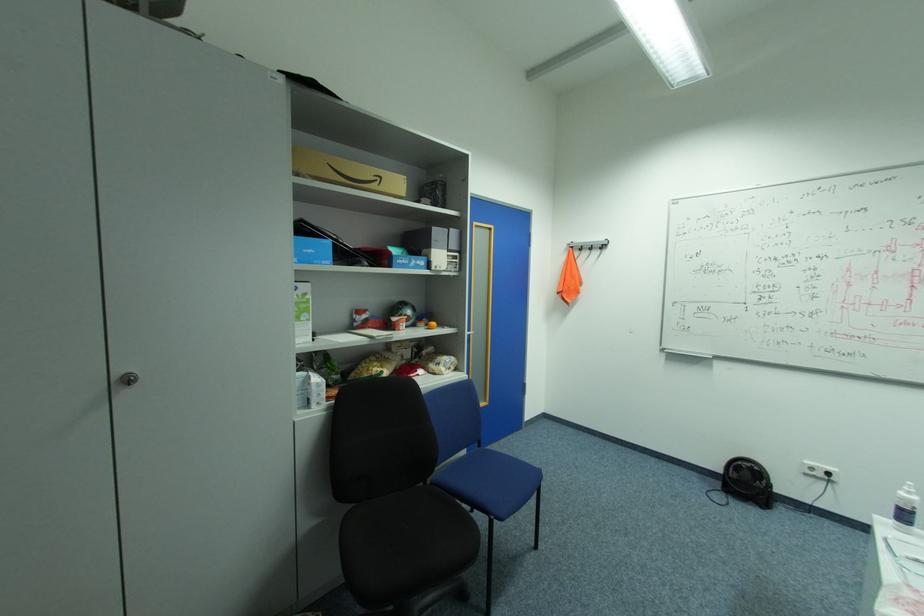
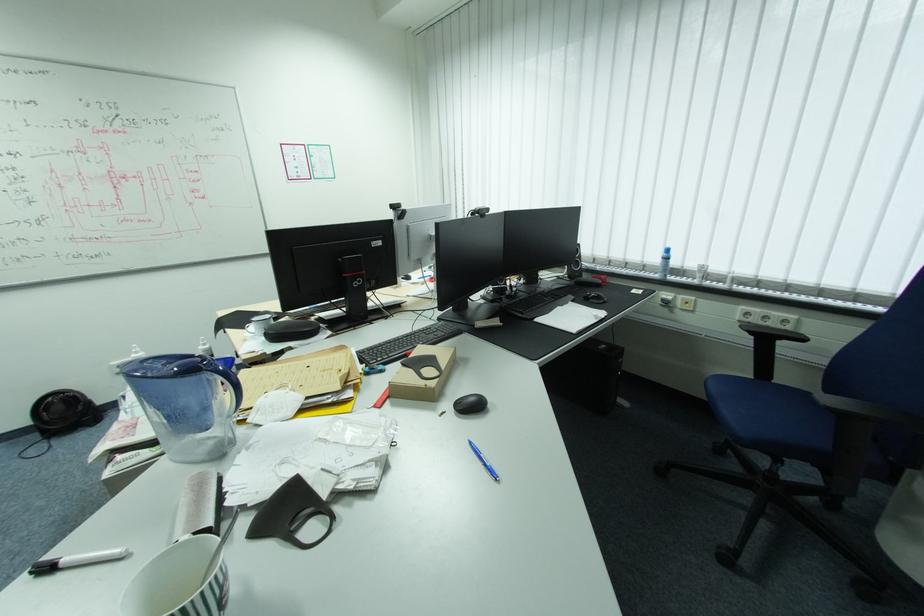
How did the camera likely rotate?

The camera's rotation is toward right-down.